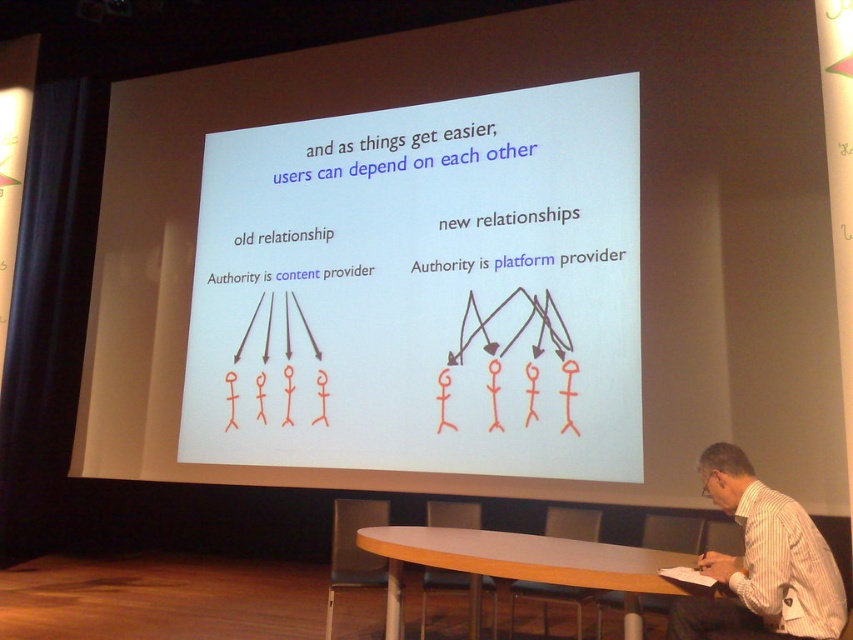
Who is higher up, white paper at center or white striped shirt at lower right?

white paper at center is higher up.

Measure the distance between white paper at center and white striped shirt at lower right.

A distance of 3.23 meters exists between white paper at center and white striped shirt at lower right.

Is point (291, 208) farther from camera compared to point (762, 552)?

Yes, point (291, 208) is farther from viewer.

Find the location of `white paper at center`. white paper at center is located at coordinates (422, 289).

Can you confirm if white paper at center is wider than light brown wooden table at center?

Yes.

Where is `white paper at center`? This screenshot has width=853, height=640. white paper at center is located at coordinates (422, 289).

Does white striped shirt at lower right lie behind light brown wooden table at center?

No, it is not.

Is white striped shirt at lower right to the right of light brown wooden table at center from the viewer's perspective?

Yes, white striped shirt at lower right is to the right of light brown wooden table at center.

At what (x,y) coordinates should I click in order to perform the action: click on white striped shirt at lower right. Please return your answer as a coordinate pair (x, y). This screenshot has height=640, width=853. Looking at the image, I should click on (761, 561).